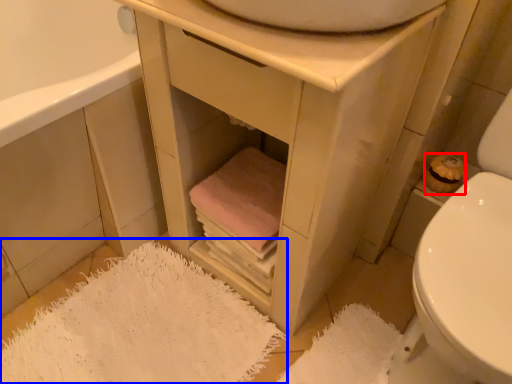
Question: Among these objects, which one is farthest to the camera, toilet paper (highlighted by a red box) or bath mat (highlighted by a blue box)?

Choices:
 (A) toilet paper
 (B) bath mat

Answer: (A)